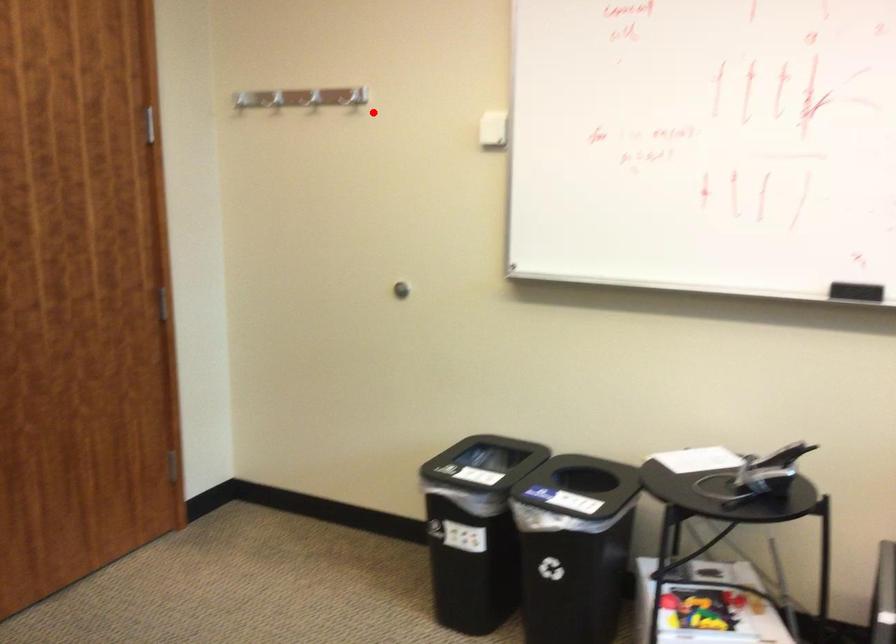
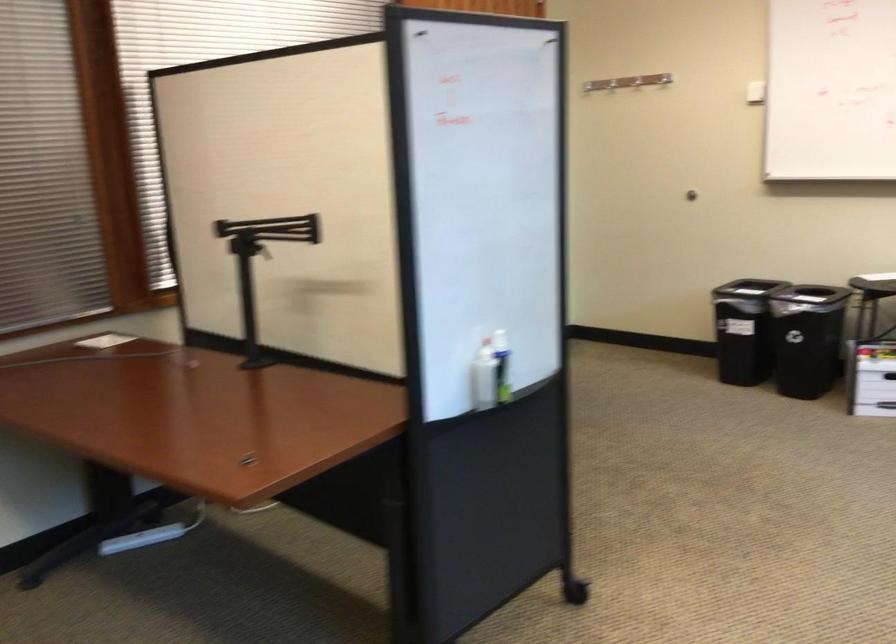
In the second image, find the point that corresponds to the highlighted location in the first image.

(590, 86)